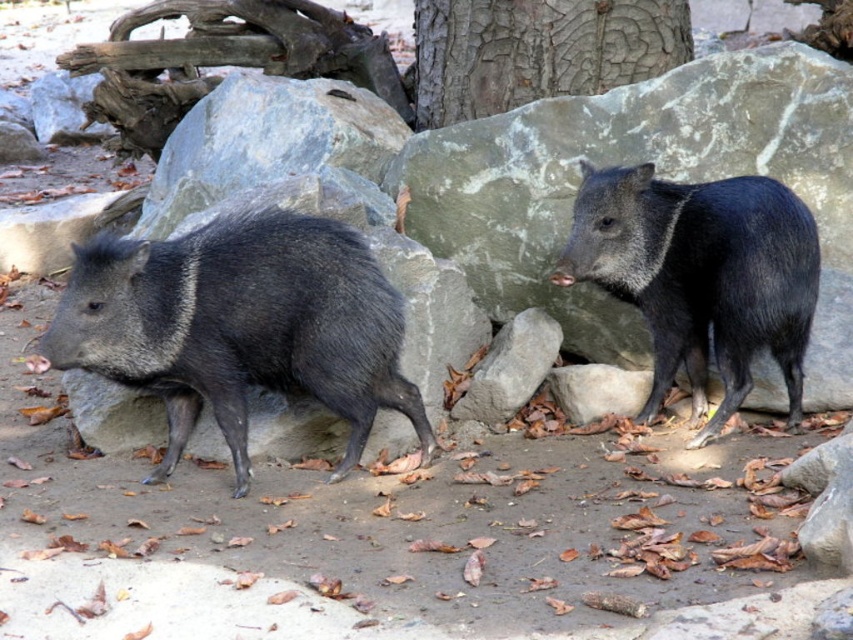
Can you confirm if shiny black boar at left is smaller than black glossy pig at upper right?

No.

Can you confirm if shiny black boar at left is positioned above black glossy pig at upper right?

No.

Where is `shiny black boar at left`? The height and width of the screenshot is (640, 853). shiny black boar at left is located at coordinates (241, 326).

Where is `shiny black boar at left`? Image resolution: width=853 pixels, height=640 pixels. shiny black boar at left is located at coordinates (241, 326).

Which is behind, point (338, 401) or point (439, 122)?

The point (439, 122) is more distant.

Which is in front, point (387, 288) or point (480, 26)?

Point (387, 288) is more forward.

The image size is (853, 640). What are the coordinates of `shiny black boar at left` in the screenshot? It's located at (241, 326).

Can you confirm if black glossy pig at upper right is wider than cracked bark tree trunk at upper center?

No.

Is point (723, 342) farther from viewer compared to point (413, 36)?

No, (723, 342) is closer to viewer.

What are the coordinates of `black glossy pig at upper right` in the screenshot? It's located at (701, 276).